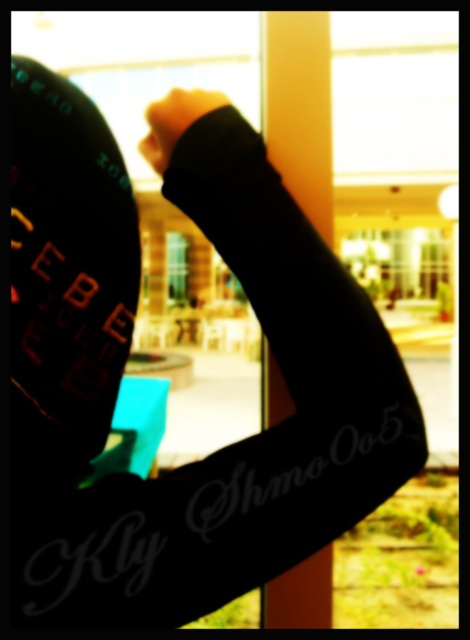
Who is positioned more to the right, black matte hand at center or clear glass window at center?

Positioned to the right is black matte hand at center.

Who is taller, black matte hand at center or clear glass window at center?

clear glass window at center

Find the location of `black matte hand at center`. black matte hand at center is located at coordinates (174, 122).